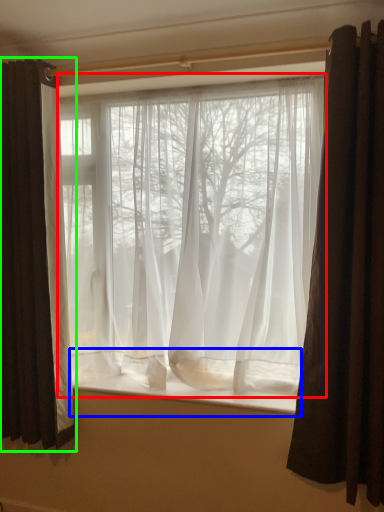
Question: Which is farther away from curtain (highlighted by a red box)? window sill (highlighted by a blue box) or curtain (highlighted by a green box)?

Choices:
 (A) window sill
 (B) curtain

Answer: (A)